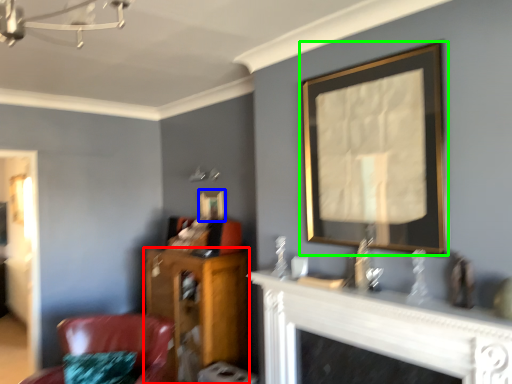
Question: Which object is the farthest from furniture (highlighted by a red box)? Choose among these: picture frame (highlighted by a blue box) or picture frame (highlighted by a green box).

Choices:
 (A) picture frame
 (B) picture frame

Answer: (B)